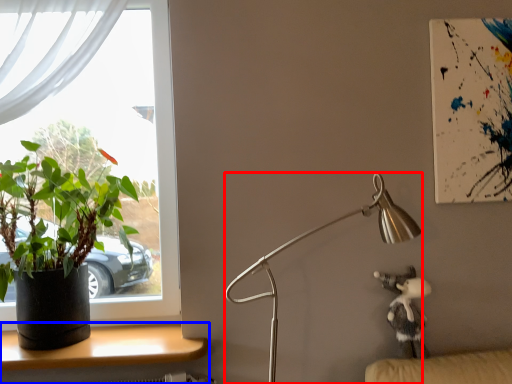
Question: Which of the following is the closest to the observer, lamp (highlighted by a red box) or desk (highlighted by a blue box)?

Choices:
 (A) lamp
 (B) desk

Answer: (A)